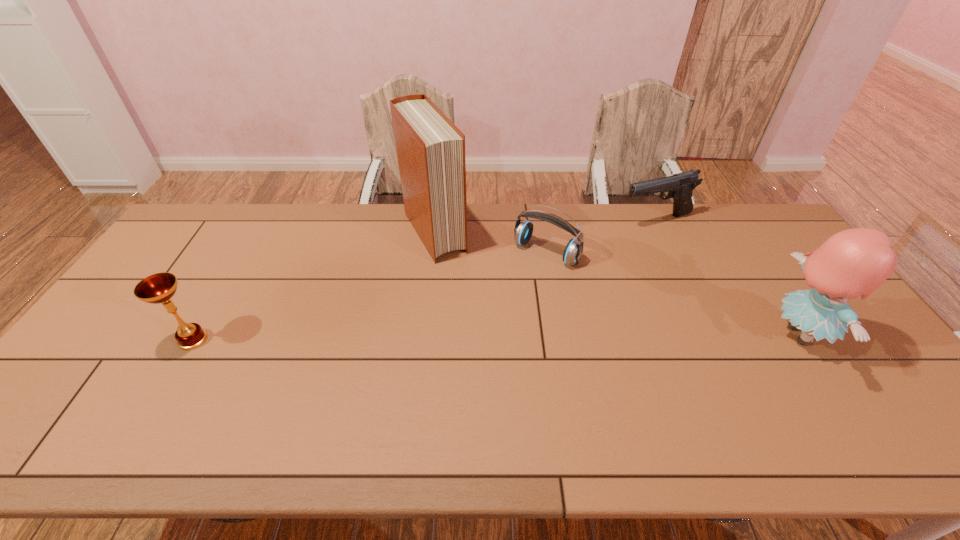
Find the location of `free space between the chalice and the gun`. free space between the chalice and the gun is located at coordinates (425, 280).

The height and width of the screenshot is (540, 960). I want to click on vacant point located between the leftmost object and the rightmost object, so click(495, 337).

This screenshot has width=960, height=540. I want to click on empty space between the gun and the third object from right to left, so click(601, 237).

Find the location of a particular element. Image resolution: width=960 pixels, height=540 pixels. free area in between the hardback book and the rightmost object is located at coordinates (616, 284).

Identify the location of free space that is in between the fourth object from right to left and the gun. (545, 227).

Locate an element on the screen. This screenshot has height=540, width=960. free spot between the doll and the gun is located at coordinates (727, 278).

At what (x,y) coordinates should I click in order to perform the action: click on blank region between the fourth shortest object and the leftmost object. Please return your answer as a coordinate pair (x, y). Looking at the image, I should click on (495, 337).

Find the location of a particular element. The image size is (960, 540). free space between the rightmost object and the chalice is located at coordinates (495, 337).

The width and height of the screenshot is (960, 540). Find the location of `unoccupied area between the rightmost object and the headset`. unoccupied area between the rightmost object and the headset is located at coordinates (672, 294).

You are a GUI agent. You are given a task and a screenshot of the screen. Output one action in this format:
    pyautogui.click(x=<x>, y=<y>)
    Task: Click on the object that can be found as the closest to the headset
    The height and width of the screenshot is (540, 960).
    Given the screenshot: What is the action you would take?
    pyautogui.click(x=430, y=149)